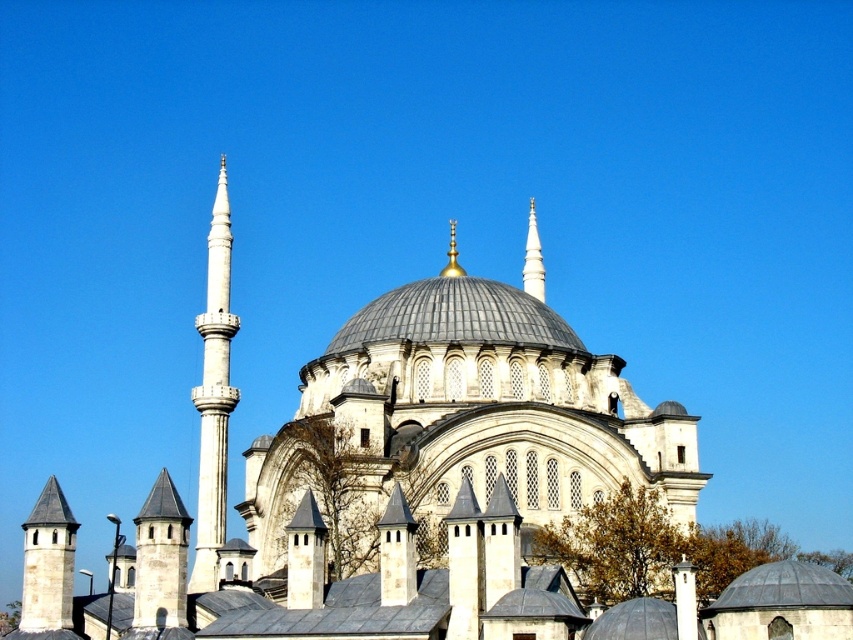
Can you confirm if white stone minaret at lower left is bigger than white marble spire at center?

Correct, white stone minaret at lower left is larger in size than white marble spire at center.

At what (x,y) coordinates should I click in order to perform the action: click on white stone minaret at lower left. Please return your answer as a coordinate pair (x, y). This screenshot has height=640, width=853. Looking at the image, I should click on pos(48,566).

Does point (206, 490) come farther from viewer compared to point (170, 586)?

Yes, it is behind point (170, 586).

Can you confirm if white stone minaret at left is shorter than stone tower at lower left?

Incorrect, white stone minaret at left's height does not fall short of stone tower at lower left's.

Is point (218, 500) less distant than point (134, 518)?

That is True.

Locate an element on the screen. white stone minaret at left is located at coordinates (213, 394).

Between point (537, 248) and point (451, 227), which one is positioned behind?

The point (451, 227) is more distant.

Does white marble spire at center appear over gold/golden metallic spire at center?

No.

Measure the distance between white marble spire at center and camera.

A distance of 334.30 feet exists between white marble spire at center and camera.

Find the location of a particular element. The width and height of the screenshot is (853, 640). white marble spire at center is located at coordinates (532, 259).